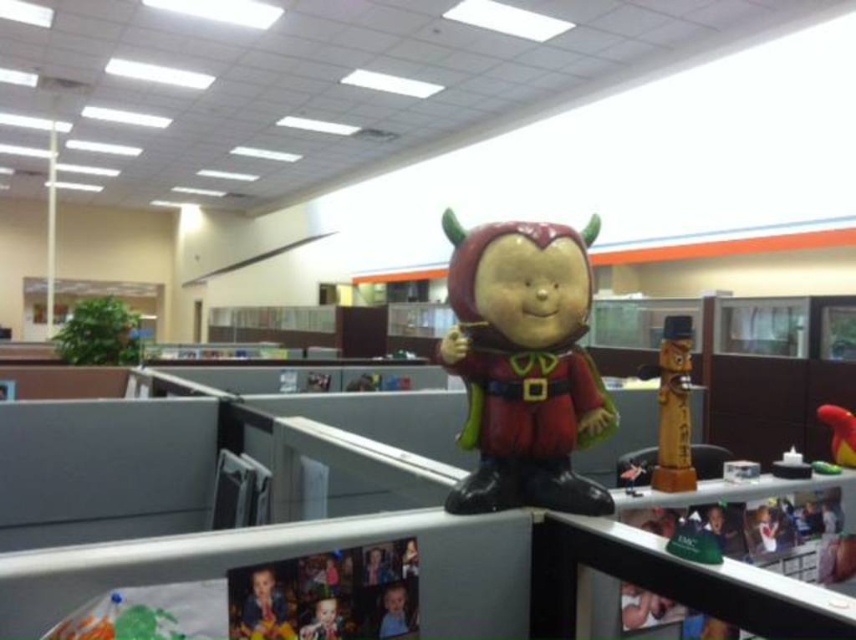
Who is more forward, (485, 323) or (675, 465)?

Positioned in front is point (485, 323).

Who is positioned more to the right, matte plastic toy at center or wooden statue at right?

wooden statue at right is more to the right.

Where is `matte plastic toy at center`? matte plastic toy at center is located at coordinates (524, 364).

You are a GUI agent. You are given a task and a screenshot of the screen. Output one action in this format:
    pyautogui.click(x=<x>, y=<y>)
    Task: Click on the matte plastic toy at center
    
    Given the screenshot: What is the action you would take?
    pyautogui.click(x=524, y=364)

Can you confirm if matte plastic toy at center is smaller than rubber duck at upper center?

Incorrect, matte plastic toy at center is not smaller in size than rubber duck at upper center.

Is point (507, 502) farther from camera compared to point (825, 408)?

No, it is in front of (825, 408).

Is point (548, 346) behind point (816, 413)?

That is False.

This screenshot has height=640, width=856. In order to click on matte plastic toy at center in this screenshot , I will do `click(524, 364)`.

Which is in front, point (667, 342) or point (837, 451)?

Point (667, 342)

Which is below, wooden statue at right or rubber duck at upper center?

Positioned lower is rubber duck at upper center.

Identify the location of wooden statue at right. This screenshot has width=856, height=640. (675, 406).

Where is `wooden statue at right`? The height and width of the screenshot is (640, 856). wooden statue at right is located at coordinates (675, 406).